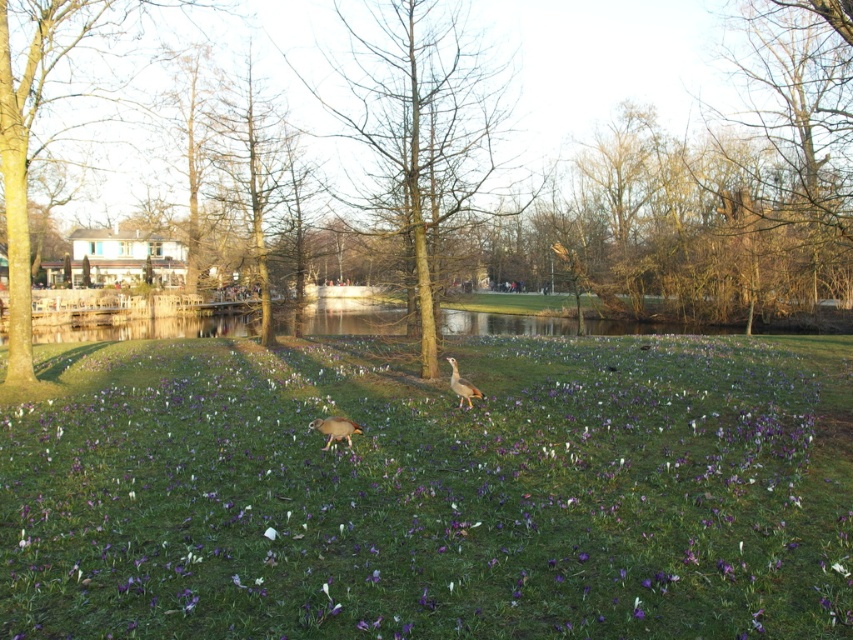
Question: Which object appears farthest from the camera in this image?

Choices:
 (A) brown/dry wood tree at center
 (B) green matte tree at center

Answer: (A)

Question: Is purple matte flower at center smaller than brown matte duck at center?

Choices:
 (A) yes
 (B) no

Answer: (B)

Question: Estimate the real-world distances between objects in this image. Which object is closer to the brown matte duck at center?

Choices:
 (A) purple matte flower at center
 (B) green leafy tree at left
 (C) brown leafless tree at center
 (D) brown/dry wood tree at center

Answer: (A)

Question: Is purple matte flower at center to the right of brown feathered bird at center from the viewer's perspective?

Choices:
 (A) yes
 (B) no

Answer: (B)

Question: Is purple matte flower at center in front of brown feathered bird at center?

Choices:
 (A) yes
 (B) no

Answer: (A)

Question: Which point is closer to the camera?

Choices:
 (A) brown leafless tree at center
 (B) green leafy tree at left
 (C) brown/dry wood tree at center

Answer: (A)